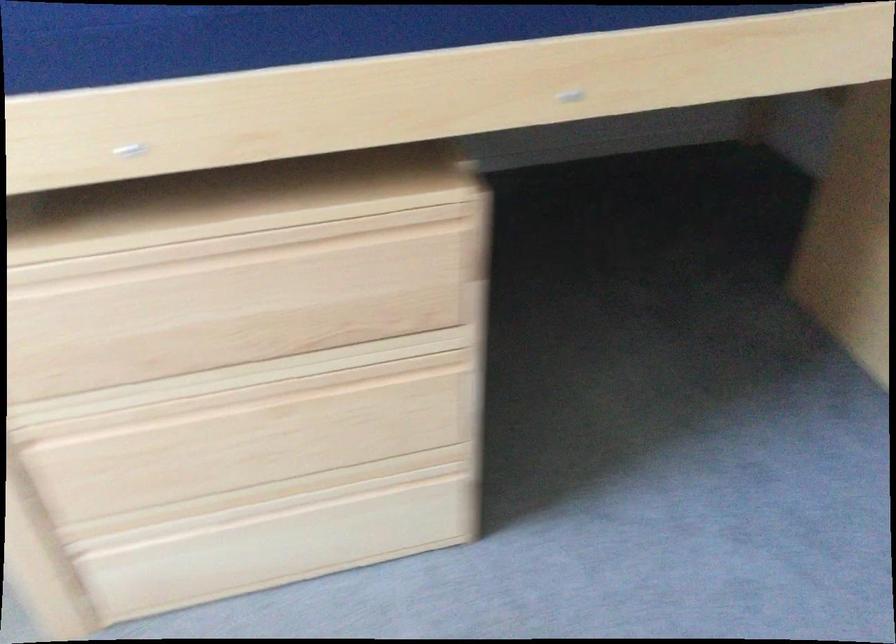
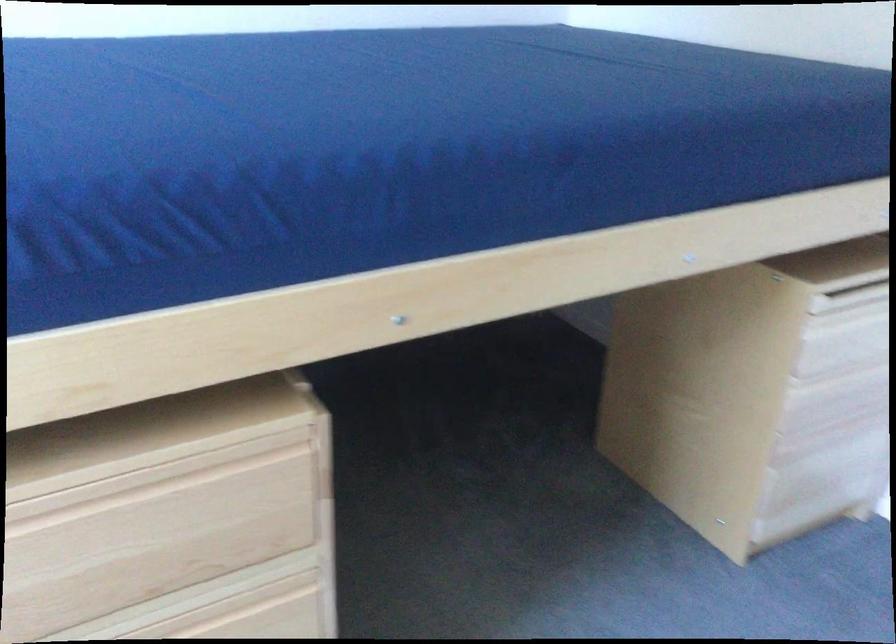
Question: How did the camera likely rotate?

Choices:
 (A) Left
 (B) Right
 (C) Up
 (D) Down

Answer: (B)